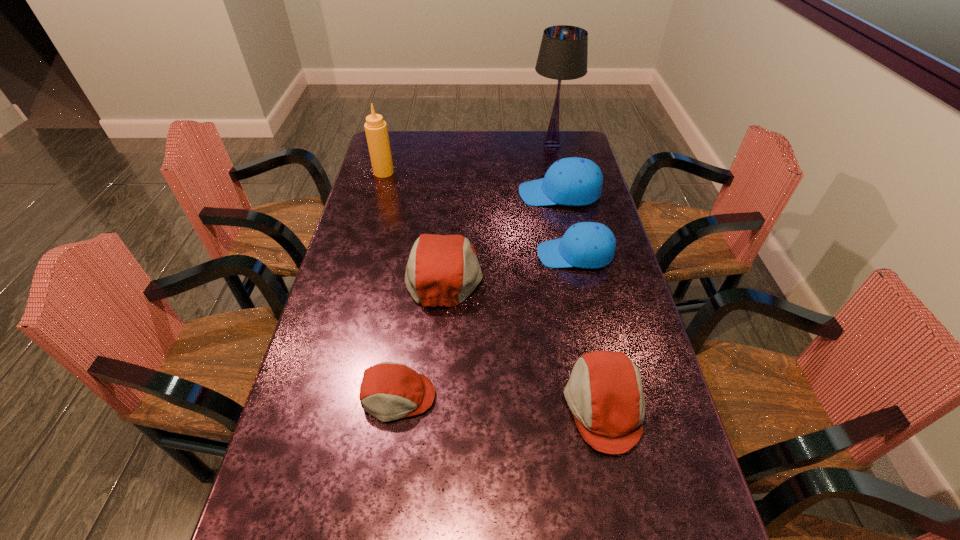
Identify the location of the shortest cap. The height and width of the screenshot is (540, 960). (389, 391).

Find the location of a particular element. free spot located 0.100m on the front-facing side of the farthest object is located at coordinates (505, 145).

Where is `free space located 0.080m on the front-facing side of the farthest object`? free space located 0.080m on the front-facing side of the farthest object is located at coordinates (510, 145).

I want to click on free space located 0.250m on the front-facing side of the farthest object, so click(469, 145).

Locate an element on the screen. The height and width of the screenshot is (540, 960). free location located on the right of the second farthest object is located at coordinates (483, 172).

This screenshot has height=540, width=960. In order to click on vacant region located 0.240m on the front-facing side of the farther blue cap in this screenshot , I will do `click(454, 194)`.

Find the location of a particular element. vacant space located on the front-facing side of the farther blue cap is located at coordinates 435,194.

Locate an element on the screen. blank space located 0.170m on the front-facing side of the farther blue cap is located at coordinates (472, 194).

Locate an element on the screen. vacant space situated 0.380m on the front-facing side of the farthest red cap is located at coordinates (608, 272).

You are a GUI agent. You are given a task and a screenshot of the screen. Output one action in this format:
    pyautogui.click(x=<x>, y=<y>)
    Task: Click on the vacant space located on the front-facing side of the smaller blue cap
    
    Given the screenshot: What is the action you would take?
    pyautogui.click(x=480, y=254)